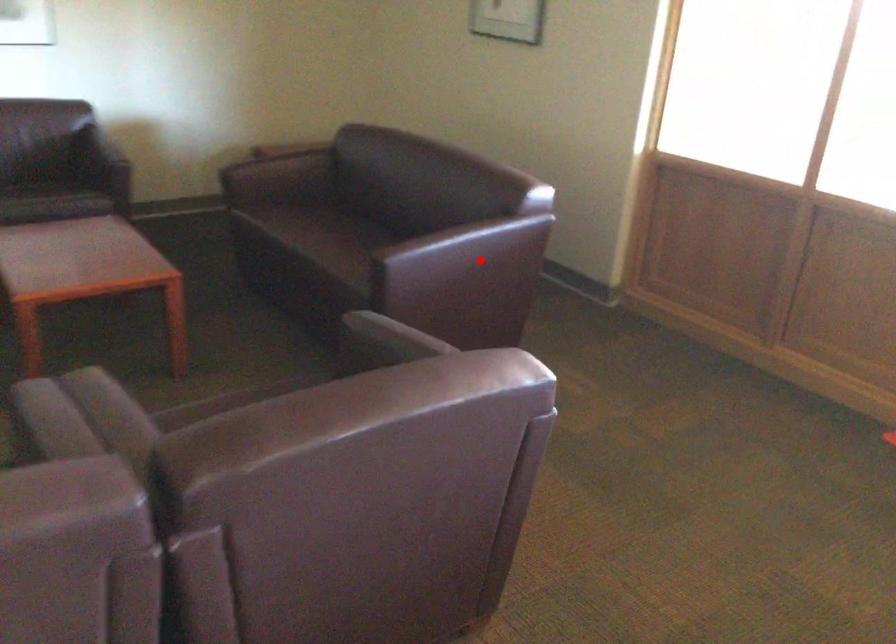
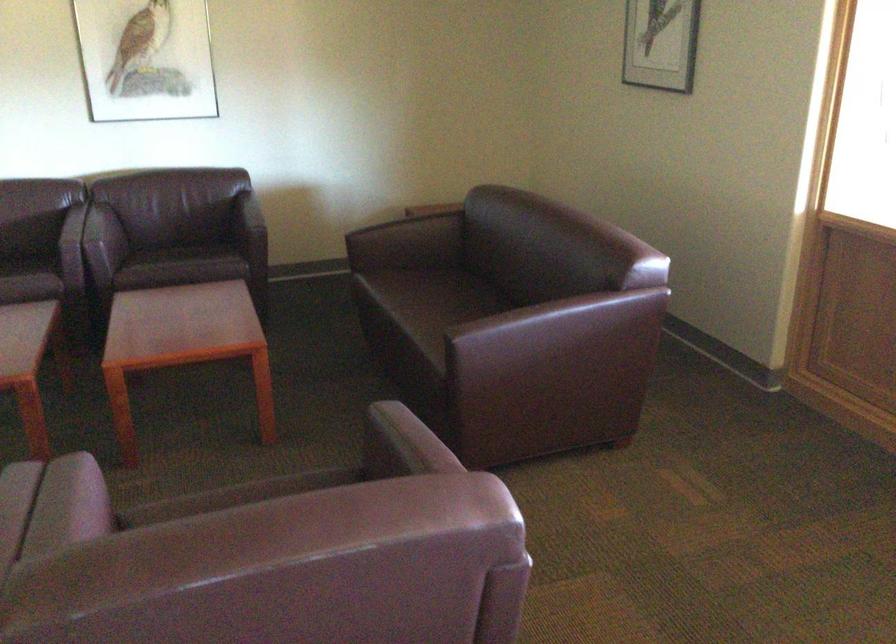
In the second image, find the point that corresponds to the highlighted location in the first image.

(561, 341)